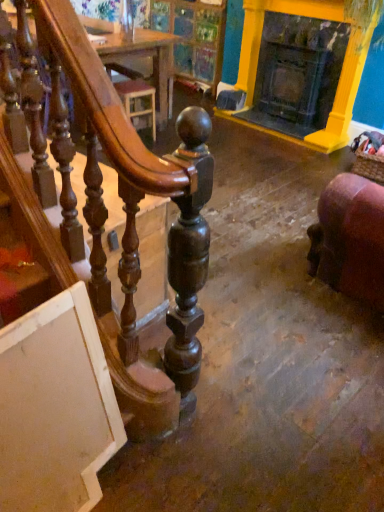
Question: In terms of height, does purple velvet chair at lower right look taller or shorter compared to yellow painted wood fireplace at upper right?

Choices:
 (A) short
 (B) tall

Answer: (A)

Question: From a real-world perspective, relative to yellow painted wood fireplace at upper right, is purple velvet chair at lower right vertically above or below?

Choices:
 (A) below
 (B) above

Answer: (A)

Question: Estimate the real-world distances between objects in this image. Which object is farther from the yellow painted wood fireplace at upper right?

Choices:
 (A) purple velvet chair at lower right
 (B) wooden table at upper center

Answer: (A)

Question: Which object is positioned farthest from the yellow painted wood fireplace at upper right?

Choices:
 (A) purple velvet chair at lower right
 (B) wooden table at upper center

Answer: (A)